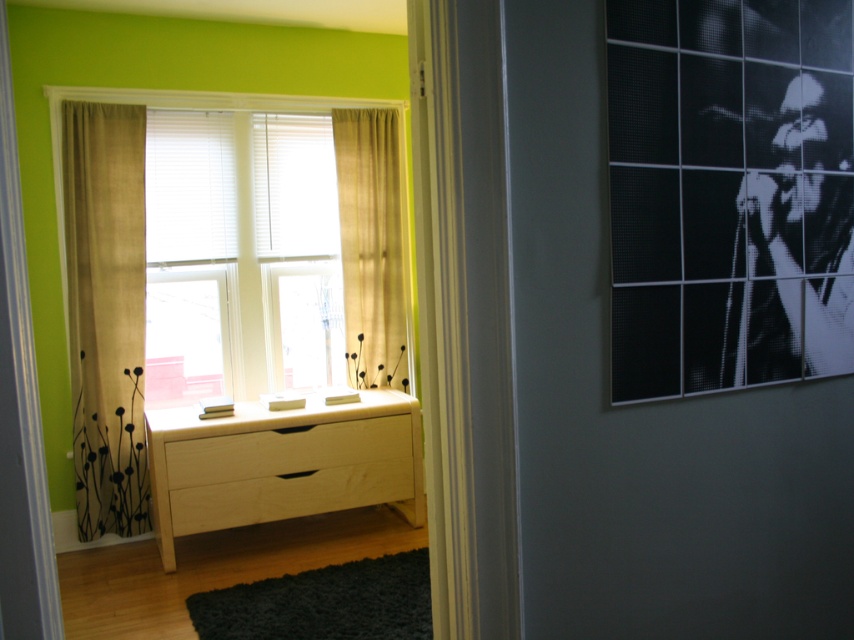
Question: Can you confirm if white matte wooden dresser at center is wider than matte wood window at center?

Choices:
 (A) no
 (B) yes

Answer: (A)

Question: Which of the following is the farthest from the observer?

Choices:
 (A) (203, 460)
 (B) (347, 428)
 (C) (785, 326)

Answer: (B)

Question: Estimate the real-world distances between objects in this image. Which object is farther from the burlap curtain at left?

Choices:
 (A) beige fabric curtain at center
 (B) matte wood window at center

Answer: (A)

Question: Which object appears closest to the camera in this image?

Choices:
 (A) white matte wooden dresser at center
 (B) matte wood window at center
 (C) burlap curtain at left

Answer: (A)

Question: Is burlap curtain at left below matte wood window at center?

Choices:
 (A) no
 (B) yes

Answer: (B)

Question: Does white matte wooden dresser at center have a lesser width compared to beige fabric curtain at center?

Choices:
 (A) no
 (B) yes

Answer: (A)